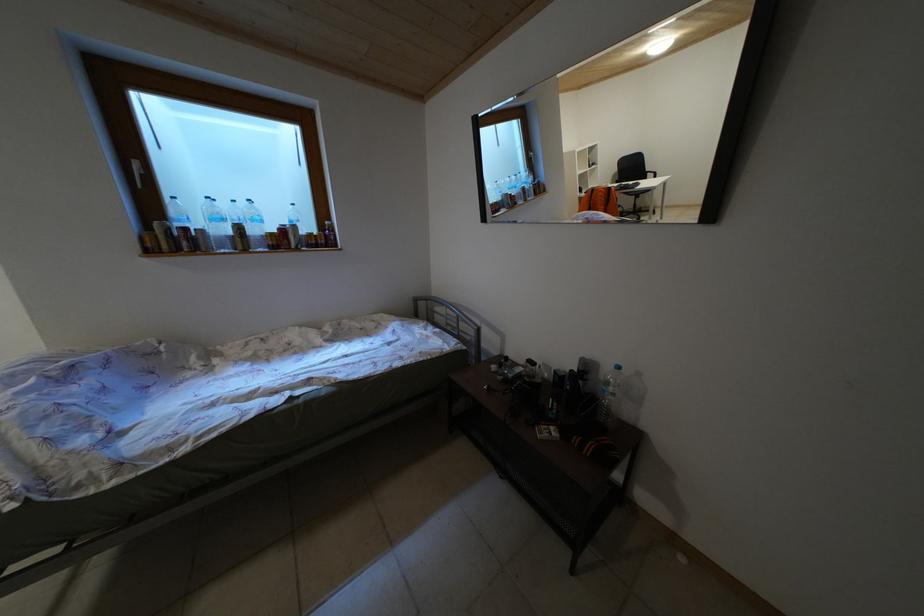
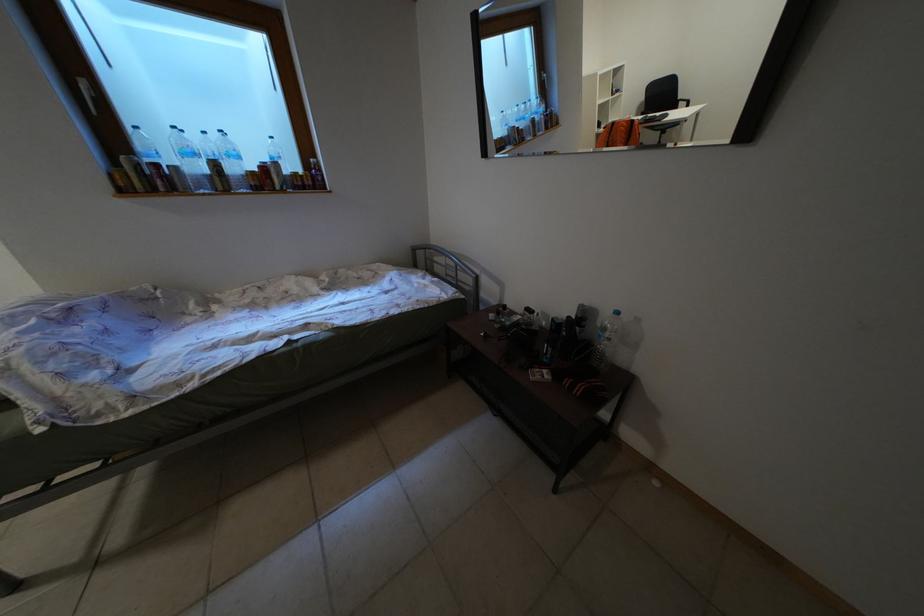
Looking at this image, in a continuous first-person perspective shot, in which direction is the camera moving?

The cameraman moved toward right, forward.